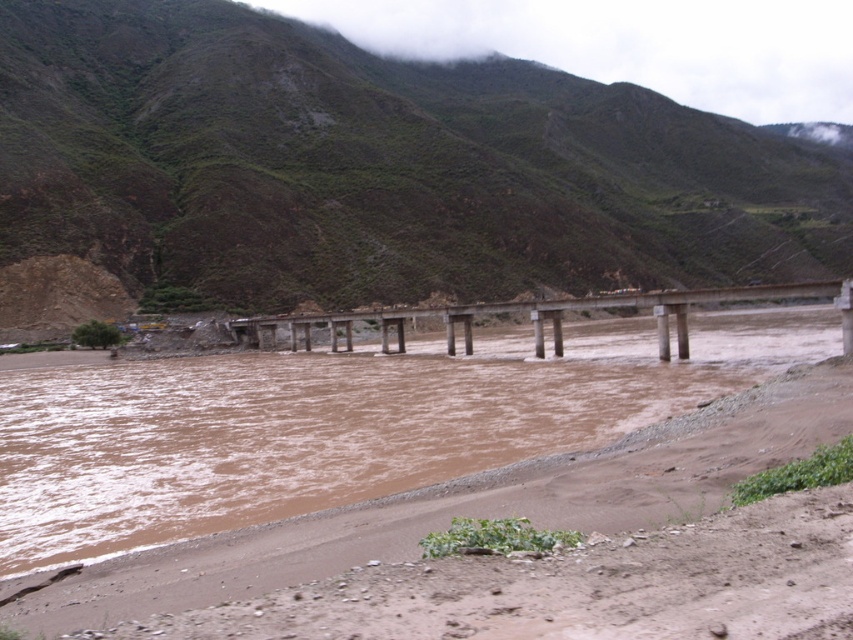
Who is higher up, green grassy hillside at upper center or brown muddy water at center?

green grassy hillside at upper center is higher up.

Between green grassy hillside at upper center and brown muddy water at center, which one has more height?

green grassy hillside at upper center

Locate an element on the screen. This screenshot has width=853, height=640. green grassy hillside at upper center is located at coordinates tap(366, 173).

Between brown muddy water at center and concrete bridge at center, which one has less height?

Standing shorter between the two is concrete bridge at center.

Is brown muddy water at center in front of concrete bridge at center?

Yes, it is.

The height and width of the screenshot is (640, 853). Find the location of `brown muddy water at center`. brown muddy water at center is located at coordinates (338, 424).

Which is more to the right, green grassy hillside at upper center or concrete bridge at center?

Positioned to the right is green grassy hillside at upper center.

Does point (628, 276) lie behind point (759, 285)?

Yes, point (628, 276) is behind point (759, 285).

Find the location of a particular element. The height and width of the screenshot is (640, 853). green grassy hillside at upper center is located at coordinates (366, 173).